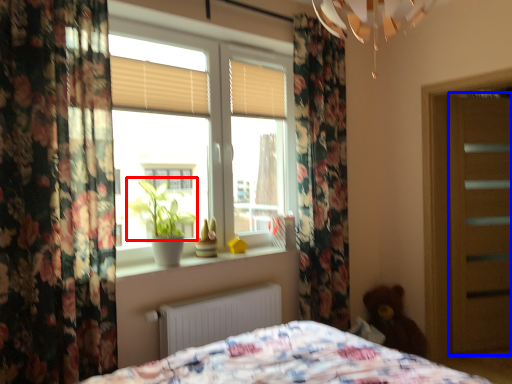
Question: Which of the following is the farthest to the observer, plant (highlighted by a red box) or screen door (highlighted by a blue box)?

Choices:
 (A) plant
 (B) screen door

Answer: (B)